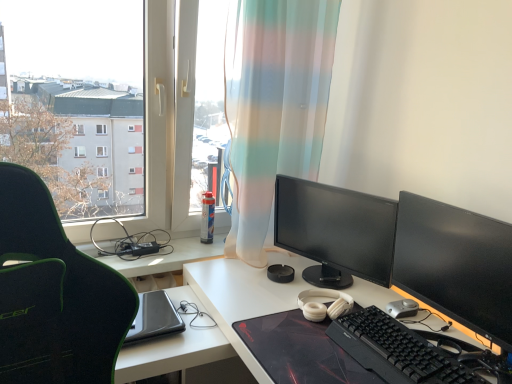
The width and height of the screenshot is (512, 384). In order to click on free location in front of translucent fabric curtain at center in this screenshot , I will do `click(250, 289)`.